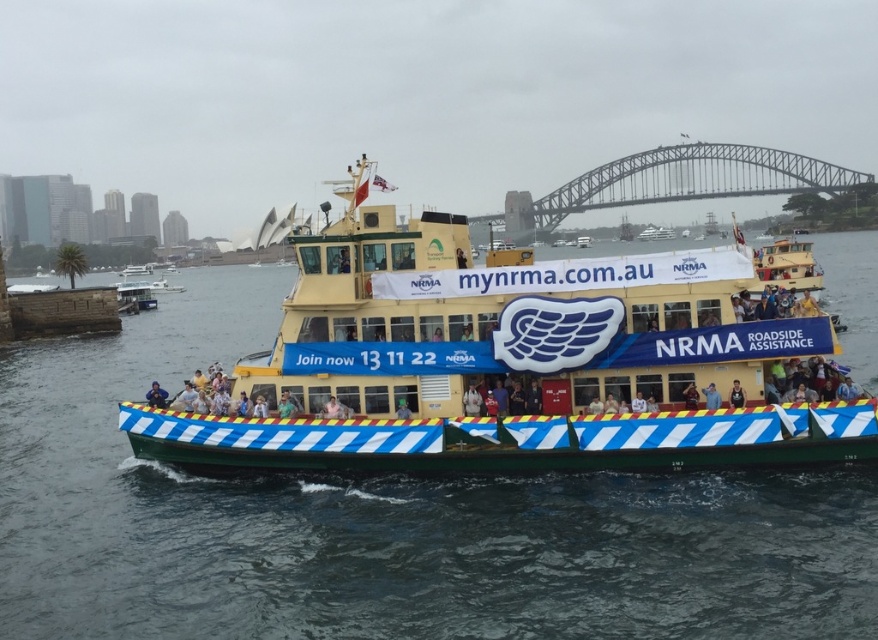
Question: Which object is farther from the camera taking this photo?

Choices:
 (A) green water at boat front
 (B) light blue fabric at center
 (C) metallic steel bridge at upper center
 (D) yellow painted metal ferry at center

Answer: (D)

Question: Does yellow painted wood ferry at center appear on the left side of yellow painted ferry at center?

Choices:
 (A) yes
 (B) no

Answer: (B)

Question: Considering the relative positions of green water at boat front and yellow painted wood ferry at center in the image provided, where is green water at boat front located with respect to yellow painted wood ferry at center?

Choices:
 (A) left
 (B) right

Answer: (A)

Question: Is blue fabric jacket at lower left further to camera compared to yellow painted ferry at center?

Choices:
 (A) yes
 (B) no

Answer: (B)

Question: Which object is the closest to the green water at boat front?

Choices:
 (A) yellow painted ferry at center
 (B) dark blue fabric at center
 (C) blue fabric jacket at lower left

Answer: (C)

Question: Which is nearer to the yellow painted metal ferry at center?

Choices:
 (A) metallic steel bridge at upper center
 (B) blue fabric at center
 (C) blue fabric jacket at lower left

Answer: (A)